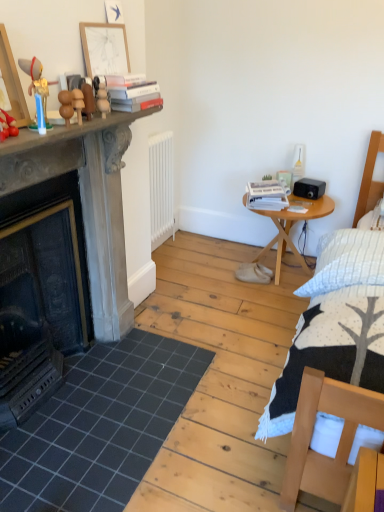
This screenshot has width=384, height=512. Find the location of `hardcover books at upper center, marked as the second book in a bottom-to-top arrangement`. hardcover books at upper center, marked as the second book in a bottom-to-top arrangement is located at coordinates (134, 95).

Find the location of `wooden picture frame at left, arranged as the first picture frame when viewed from the front`. wooden picture frame at left, arranged as the first picture frame when viewed from the front is located at coordinates (12, 82).

This screenshot has width=384, height=512. I want to click on smooth stone fireplace at left, so click(86, 202).

The height and width of the screenshot is (512, 384). In order to click on wooden balls at upper left, the second toy in the back-to-front sequence in this screenshot , I will do `click(71, 105)`.

Locate an element on the screen. The width and height of the screenshot is (384, 512). wooden figurines at upper center, which appears as the first toy when viewed from the back is located at coordinates (101, 96).

Is there a large distance between wooden figurine at left, the 3th toy viewed from the right, and wooden round table at right?

Yes, wooden figurine at left, the 3th toy viewed from the right, and wooden round table at right are quite far apart.

How many degrees apart are the facing directions of wooden figurine at left, the first toy positioned from the front, and wooden round table at right?

They differ by 90.5 degrees in their facing directions.

Does wooden figurine at left, which is counted as the 1th toy, starting from the left, have a greater width compared to wooden round table at right?

Incorrect, the width of wooden figurine at left, which is counted as the 1th toy, starting from the left, does not surpass that of wooden round table at right.

Which object is further away from the camera, wooden balls at upper left, placed as the 2th toy when sorted from left to right, or white matte radiator at center?

white matte radiator at center is behind.

Is wooden balls at upper left, placed as the 2th toy when sorted from left to right, wider or thinner than white matte radiator at center?

Considering their sizes, wooden balls at upper left, placed as the 2th toy when sorted from left to right, looks slimmer than white matte radiator at center.

Which is nearer, (x=62, y=98) or (x=150, y=145)?

Point (x=62, y=98) is closer to the camera than point (x=150, y=145).

From the image's perspective, is smooth stone fireplace at left under wooden figurine at left, the first toy positioned from the front?

Yes, from the image's perspective, smooth stone fireplace at left is beneath wooden figurine at left, the first toy positioned from the front.

From a real-world perspective, is smooth stone fireplace at left above or below wooden figurine at left, the 3th toy positioned from the back?

From a real-world perspective, smooth stone fireplace at left is physically below wooden figurine at left, the 3th toy positioned from the back.

Does smooth stone fireplace at left come in front of wooden figurine at left, which is counted as the 1th toy, starting from the left?

Yes, it is.

Can you confirm if smooth stone fireplace at left is taller than wooden figurine at left, the 3th toy positioned from the back?

Yes.

Measure the distance from white matte radiator at center to wooden figurines at upper center, which appears as the first toy when viewed from the back.

white matte radiator at center is 4.20 feet from wooden figurines at upper center, which appears as the first toy when viewed from the back.

Can you confirm if white matte radiator at center is positioned to the left of wooden figurines at upper center, which is the third toy in front-to-back order?

No, white matte radiator at center is not to the left of wooden figurines at upper center, which is the third toy in front-to-back order.

Considering the sizes of objects white matte radiator at center and wooden figurines at upper center, which is counted as the first toy, starting from the right, in the image provided, who is taller, white matte radiator at center or wooden figurines at upper center, which is counted as the first toy, starting from the right,?

Standing taller between the two is white matte radiator at center.

Is wooden figurines at upper center, which appears as the first toy when viewed from the back, inside white matte radiator at center?

Actually, wooden figurines at upper center, which appears as the first toy when viewed from the back, is outside white matte radiator at center.

Considering the sizes of objects wooden figurines at upper center, which appears as the first toy when viewed from the back, and wooden picture frame at left, the first picture frame when ordered from left to right, in the image provided, who is smaller, wooden figurines at upper center, which appears as the first toy when viewed from the back, or wooden picture frame at left, the first picture frame when ordered from left to right,?

Smaller between the two is wooden figurines at upper center, which appears as the first toy when viewed from the back.

From a real-world perspective, which object rests below the other?

wooden figurines at upper center, which is counted as the first toy, starting from the right, is physically lower.

Is wooden figurines at upper center, acting as the third toy starting from the left, aimed at wooden picture frame at left, acting as the first picture frame starting from the bottom?

No.

Considering the relative positions of wooden figurines at upper center, which is the third toy in front-to-back order, and wooden picture frame at left, the first picture frame when ordered from left to right, in the image provided, is wooden figurines at upper center, which is the third toy in front-to-back order, to the left or to the right of wooden picture frame at left, the first picture frame when ordered from left to right,?

From the image, it's evident that wooden figurines at upper center, which is the third toy in front-to-back order, is to the right of wooden picture frame at left, the first picture frame when ordered from left to right.

How different are the orientations of white paper stack at right, arranged as the second book when viewed from the top, and wooden figurine at left, the 3th toy positioned from the back, in degrees?

The facing directions of white paper stack at right, arranged as the second book when viewed from the top, and wooden figurine at left, the 3th toy positioned from the back, are 68.4 degrees apart.

Consider the image. Is white paper stack at right, arranged as the second book when viewed from the top, taller than wooden figurine at left, the 3th toy viewed from the right?

No.

From the image's perspective, which one is positioned higher, white paper stack at right, arranged as the second book when viewed from the top, or wooden figurine at left, which is counted as the 1th toy, starting from the left?

white paper stack at right, arranged as the second book when viewed from the top, is shown above in the image.

Choose the correct answer: Is white paper stack at right, which is the second book from left to right, inside wooden figurine at left, the 3th toy positioned from the back, or outside it?

white paper stack at right, which is the second book from left to right, is not inside wooden figurine at left, the 3th toy positioned from the back, it's outside.

Is there a large distance between dark gray tile at lower left and wooden figurine at left, the first toy positioned from the front?

Yes.

From the image's perspective, is dark gray tile at lower left beneath wooden figurine at left, the 3th toy positioned from the back?

Yes.

Is dark gray tile at lower left oriented towards wooden figurine at left, the 3th toy viewed from the right?

No, dark gray tile at lower left does not turn towards wooden figurine at left, the 3th toy viewed from the right.

The height and width of the screenshot is (512, 384). What are the coordinates of `the 3rd toy in front when counting from the wooden round table at right` in the screenshot? It's located at (7, 126).

I want to click on radiator below the wooden balls at upper left, which appears as the 2th toy when viewed from the front (from a real-world perspective), so click(x=161, y=188).

Which object lies nearer to the anchor point dark gray tile at lower left, white matte radiator at center or wooden figurines at upper center, which is the third toy in front-to-back order?

Among the two, white matte radiator at center is located nearer to dark gray tile at lower left.

Which object lies nearer to the anchor point hardcover books at upper center, which is the 2th book from right to left, wooden figurine at left, the 3th toy positioned from the back, or wooden balls at upper left, positioned as the 2th toy in right-to-left order?

wooden balls at upper left, positioned as the 2th toy in right-to-left order, is closer to hardcover books at upper center, which is the 2th book from right to left.

Which object lies nearer to the anchor point wooden figurine at left, the 3th toy positioned from the back, dark gray tile at lower left or hardcover books at upper center, which ranks as the first book in top-to-bottom order?

Among the two, hardcover books at upper center, which ranks as the first book in top-to-bottom order, is located nearer to wooden figurine at left, the 3th toy positioned from the back.

In the scene shown: Considering their positions, is wooden picture frame at left, which is the second picture frame from top to bottom, positioned further to white matte radiator at center than wooden balls at upper left, the second toy in the back-to-front sequence?

wooden picture frame at left, which is the second picture frame from top to bottom, lies further to white matte radiator at center than the other object.

Estimate the real-world distances between objects in this image. Which object is further from wooden balls at upper left, positioned as the 2th toy in right-to-left order, white matte radiator at center or wooden picture frame at left, arranged as the first picture frame when viewed from the front?

Among the two, white matte radiator at center is located further to wooden balls at upper left, positioned as the 2th toy in right-to-left order.

Which object lies further to the anchor point wooden round table at right, wooden balls at upper left, positioned as the 2th toy in right-to-left order, or wooden figurines at upper center, acting as the third toy starting from the left?

The object further to wooden round table at right is wooden balls at upper left, positioned as the 2th toy in right-to-left order.

From the image, which object appears to be farther from wooden figurine at left, the first toy positioned from the front, wooden balls at upper left, which appears as the 2th toy when viewed from the front, or wooden round table at right?

wooden round table at right is positioned further to the anchor wooden figurine at left, the first toy positioned from the front.

From the image, which object appears to be farther from wooden picture frame at upper center, which appears as the 1th picture frame when viewed from the right, white matte radiator at center or wooden round table at right?

wooden round table at right is positioned further to the anchor wooden picture frame at upper center, which appears as the 1th picture frame when viewed from the right.

Find the location of a particular element. The width and height of the screenshot is (384, 512). book between hardcover books at upper center, placed as the first book when sorted from left to right, and white matte radiator at center, along the z-axis is located at coordinates (266, 195).

Identify the location of book between smooth stone fireplace at left and white paper stack at right, arranged as the second book when viewed from the top, in the front-back direction. The height and width of the screenshot is (512, 384). click(x=134, y=95).

The height and width of the screenshot is (512, 384). In order to click on table between wooden figurines at upper center, which appears as the first toy when viewed from the back, and dark gray tile at lower left in the up-down direction in this screenshot , I will do `click(86, 202)`.

I want to click on nightstand positioned between wooden figurines at upper center, which is the third toy in front-to-back order, and white paper stack at right, which is the second book from left to right, from near to far, so click(290, 228).